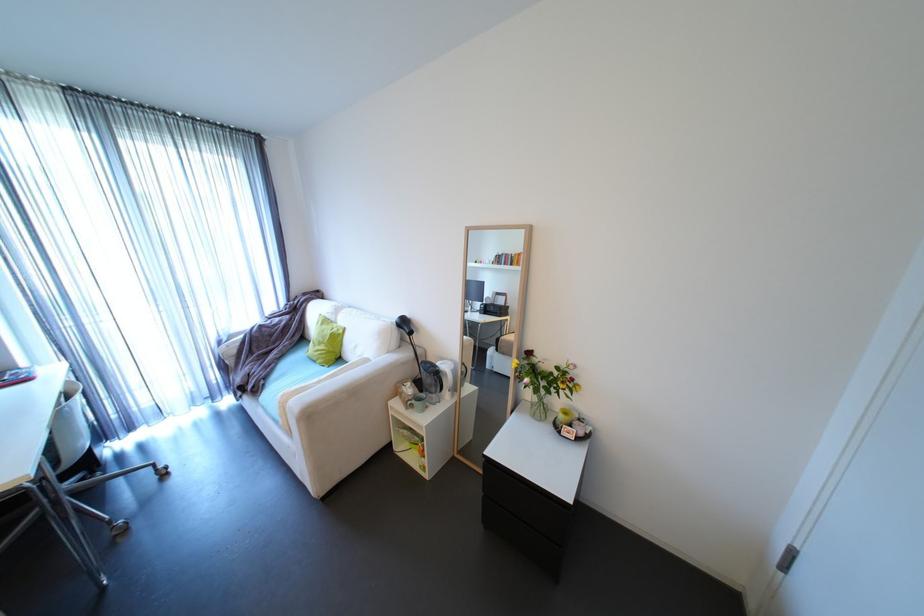
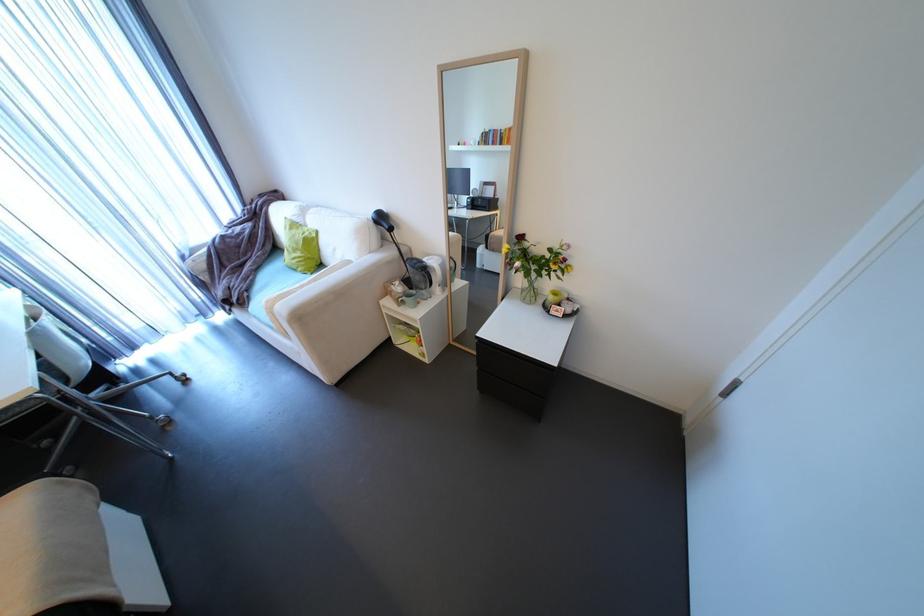
Locate, in the second image, the point that corresponds to [233,339] in the first image.

(195, 254)